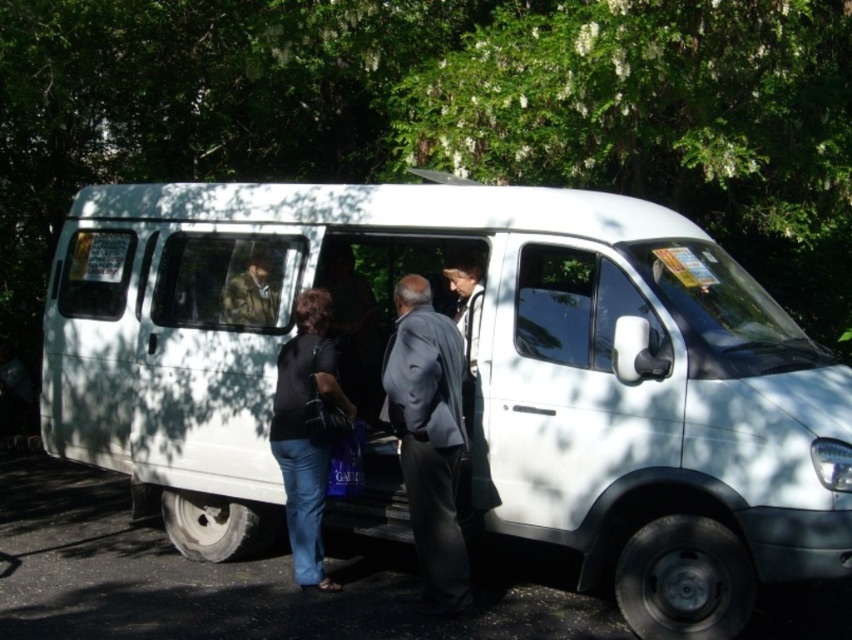
Between point (370, 308) and point (430, 390), which one is positioned behind?

The point (370, 308) is behind.

Is point (170, 468) positioned in front of point (435, 454)?

No.

Locate an element on the screen. white matte van at center is located at coordinates 467,378.

Who is positioned more to the left, gray fabric suit at center or black matte shirt at center?

Positioned to the left is black matte shirt at center.

At what (x,y) coordinates should I click in order to perform the action: click on gray fabric suit at center. Please return your answer as a coordinate pair (x, y). This screenshot has height=640, width=852. Looking at the image, I should click on (429, 436).

Between black matte shirt at center and camouflage fabric jacket at center, which one appears on the left side from the viewer's perspective?

camouflage fabric jacket at center is more to the left.

Between point (312, 289) and point (269, 314), which one is positioned in front?

Positioned in front is point (312, 289).

Is point (312, 348) positioned before point (228, 301)?

Yes.

Identify the location of black matte shirt at center. (308, 433).